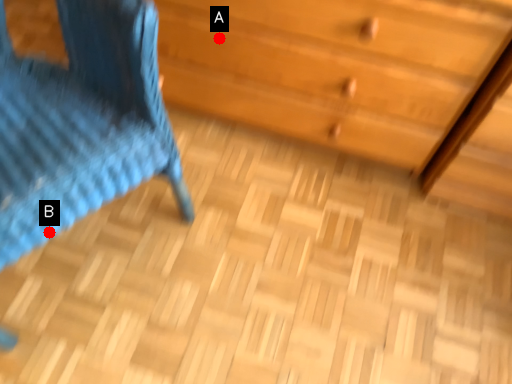
Question: Two points are circled on the image, labeled by A and B beside each circle. Which point is closer to the camera?

Choices:
 (A) A is closer
 (B) B is closer

Answer: (B)